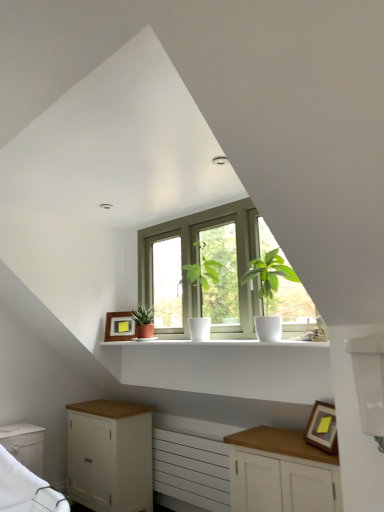
Question: Does white glossy shelf at center have a greater height compared to white matte cabinet at lower left, arranged as the 3th cabinetry when viewed from the right?

Choices:
 (A) yes
 (B) no

Answer: (B)

Question: Is white glossy shelf at center wider than white matte cabinet at lower left, which is the second cabinetry from front to back?

Choices:
 (A) no
 (B) yes

Answer: (A)

Question: From a real-world perspective, is white glossy shelf at center beneath white matte cabinet at lower left, which is the 1th cabinetry in left-to-right order?

Choices:
 (A) no
 (B) yes

Answer: (A)

Question: From the image's perspective, does white glossy shelf at center appear lower than white matte cabinet at lower left, which is the second cabinetry from front to back?

Choices:
 (A) yes
 (B) no

Answer: (B)

Question: Is white glossy shelf at center at the left side of white matte cabinet at lower left, arranged as the 3th cabinetry when viewed from the right?

Choices:
 (A) yes
 (B) no

Answer: (B)

Question: In terms of width, does white matte radiator at lower center look wider or thinner when compared to white matte cabinet at lower left, which is the second cabinetry from front to back?

Choices:
 (A) wide
 (B) thin

Answer: (B)

Question: Considering the positions of white matte radiator at lower center and white matte cabinet at lower left, which is the second cabinetry from front to back, in the image, is white matte radiator at lower center taller or shorter than white matte cabinet at lower left, which is the second cabinetry from front to back,?

Choices:
 (A) short
 (B) tall

Answer: (B)

Question: Looking at the image, does white matte radiator at lower center seem bigger or smaller compared to white matte cabinet at lower left, which is the second cabinetry from front to back?

Choices:
 (A) small
 (B) big

Answer: (A)

Question: From a real-world perspective, is white matte radiator at lower center above or below white matte cabinet at lower left, which is the 1th cabinetry in left-to-right order?

Choices:
 (A) above
 (B) below

Answer: (B)

Question: Does point tap(168, 461) appear closer or farther from the camera than point tap(117, 339)?

Choices:
 (A) farther
 (B) closer

Answer: (B)

Question: Considering the positions of white matte radiator at lower center and matte wooden picture frame at center, the 2th picture frame in the front-to-back sequence, in the image, is white matte radiator at lower center taller or shorter than matte wooden picture frame at center, the 2th picture frame in the front-to-back sequence,?

Choices:
 (A) short
 (B) tall

Answer: (B)

Question: From a real-world perspective, is white matte radiator at lower center physically located above or below matte wooden picture frame at center, which ranks as the second picture frame in right-to-left order?

Choices:
 (A) above
 (B) below

Answer: (B)

Question: Is white matte radiator at lower center wider or thinner than matte wooden picture frame at center, the 2th picture frame in the front-to-back sequence?

Choices:
 (A) wide
 (B) thin

Answer: (B)

Question: Looking at their shapes, would you say wooden framed picture at lower right, which ranks as the 1th picture frame in right-to-left order, is wider or thinner than green matte window at center?

Choices:
 (A) wide
 (B) thin

Answer: (A)

Question: Is point (307, 441) closer or farther from the camera than point (173, 330)?

Choices:
 (A) farther
 (B) closer

Answer: (B)